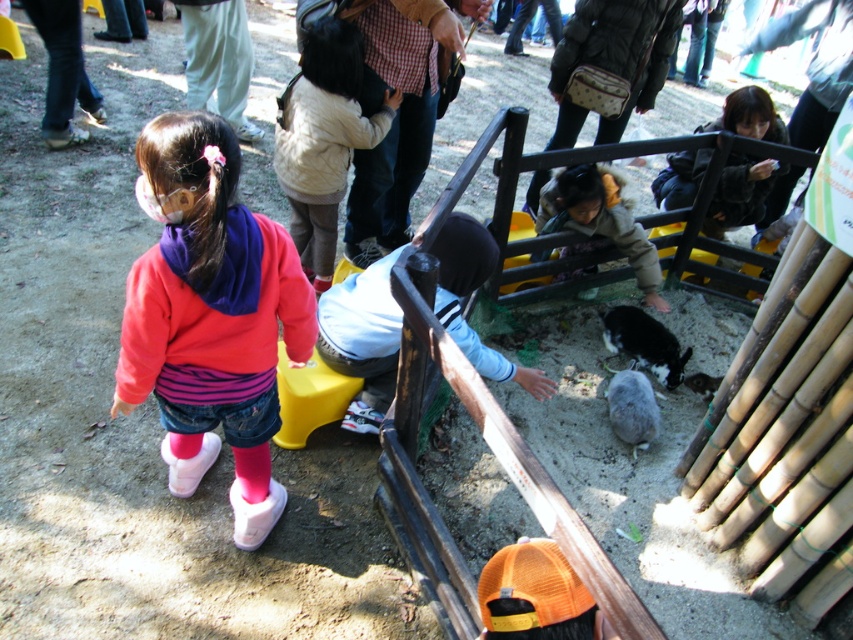
You are standing at the point marked by the coordinates (323, 138) in the image. Looking around, what object is located exactly at this point?

The point at coordinates (323, 138) corresponds to the white fuzzy jacket at center.

You are a parent trying to locate your child in the zoo. You see the pink fleece jacket at left and the light brown plush jacket at center. Which jacket is closer to you?

The pink fleece jacket at left is closer to the viewer than the light brown plush jacket at center.

The young girl in the red sweater is walking towards the fenced area with rabbits. There is a point marked at coordinates (x=740, y=193). What object does this point correspond to?

The point at coordinates (x=740, y=193) corresponds to the matte black jacket at upper right.